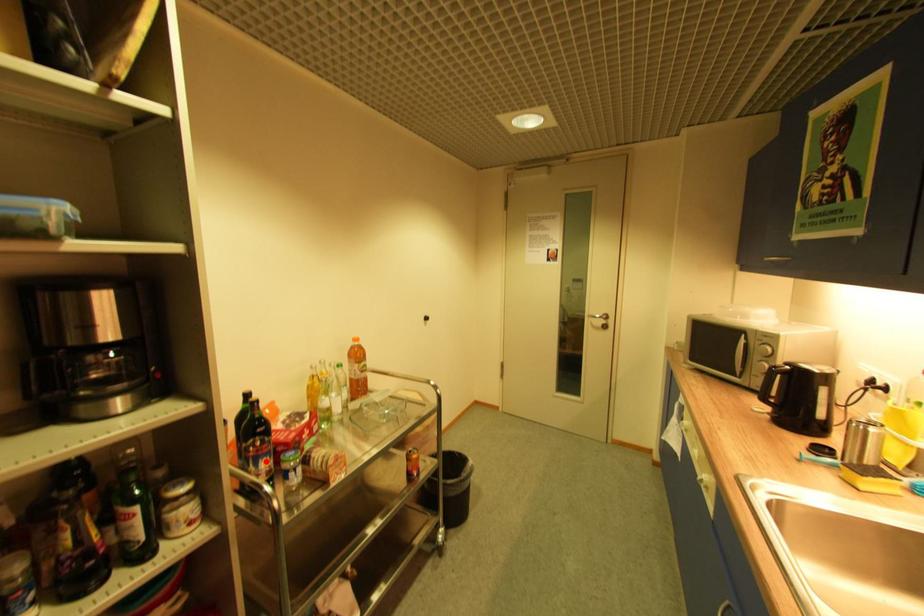
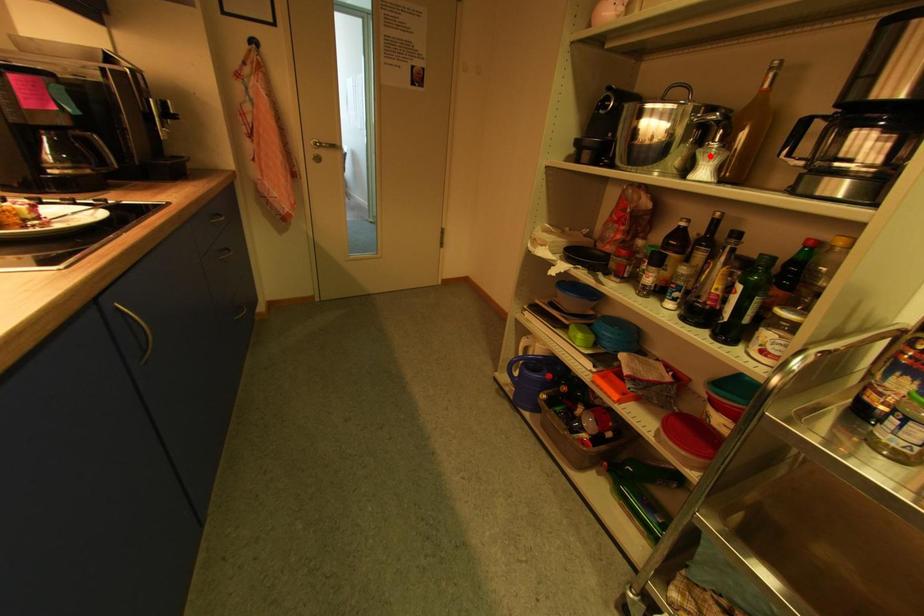
I am providing you with two images of the same scene from different viewpoints. A red point is marked on the first image and another point is marked on the second image. Does the point marked in image1 correspond to the same location as the one in image2?

No